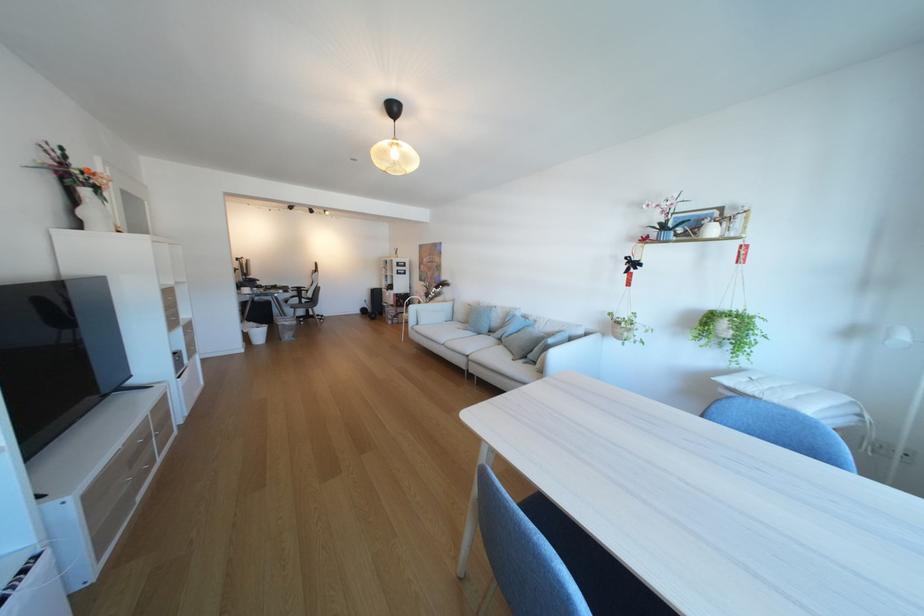
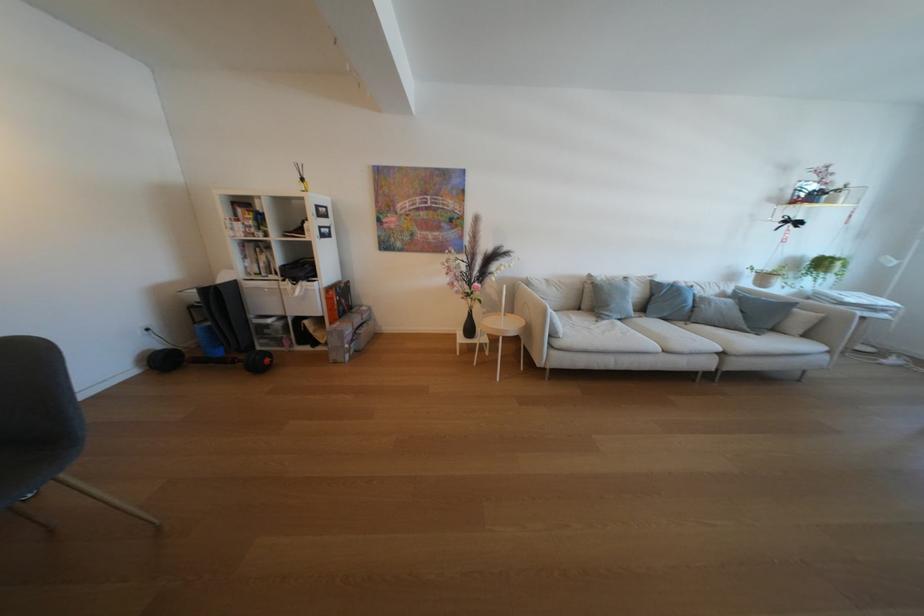
The point at (573, 329) is marked in the first image. Where is the corresponding point in the second image?

(730, 289)